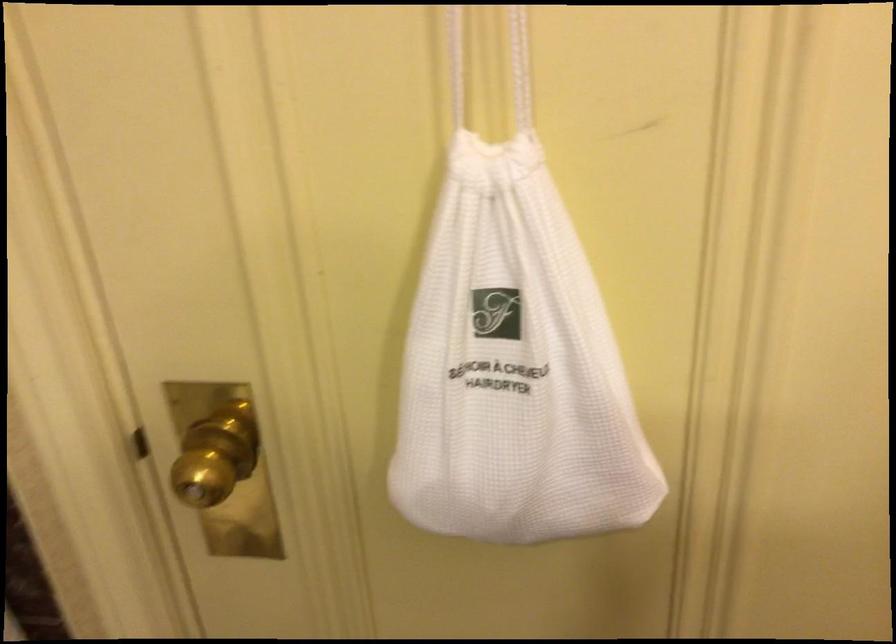
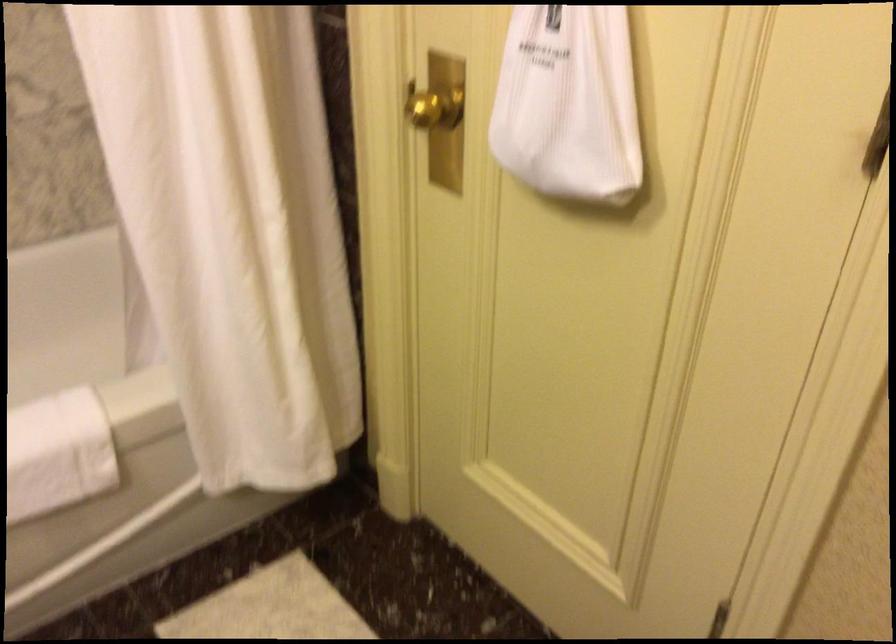
Question: Based on the continuous images, in which direction is the camera rotating? Reply with the corresponding letter.

Choices:
 (A) Left
 (B) Right
 (C) Up
 (D) Down

Answer: (A)